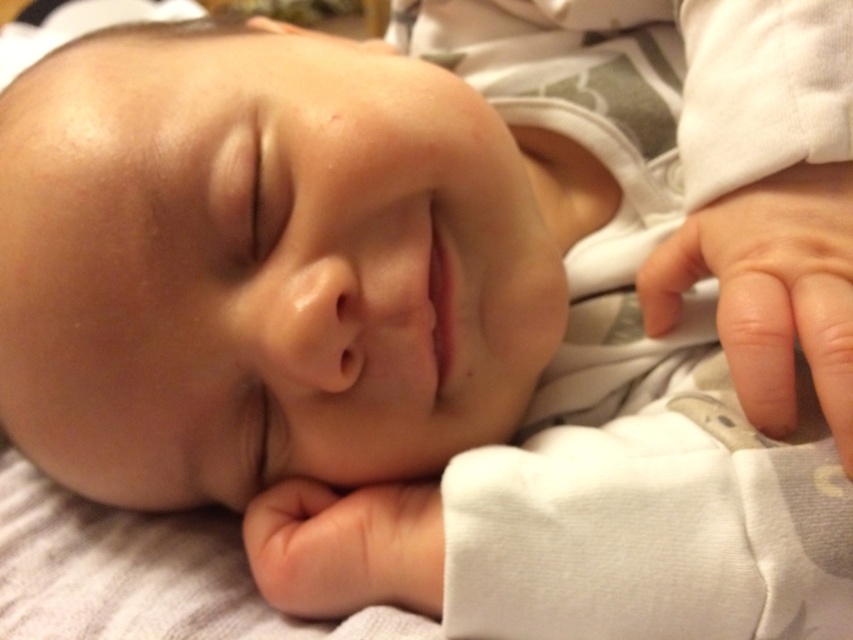
You are a photographer adjusting your camera settings to focus on the baby in the image. You notice two points of interest marked as point (782, 387) and point (419, 563). Which point should you focus on to ensure it appears sharper in the photo?

Point (782, 387) is closer to the camera than point (419, 563), so focusing on point (782, 387) will make it appear sharper in the photo.

In the image of the sleeping baby, there are two hands visible. The smooth skin hand at lower right and the smooth skin hand at lower center. Which one is positioned to the right side?

The smooth skin hand at lower right is positioned to the right of the smooth skin hand at lower center.

You are a photographer taking a close up of a baby. You want to ensure the baby stays in focus while the background is blurred. The baby has a hand in the frame. Where should you focus your camera to keep the smooth skin hand at lower right sharp?

You should focus your camera on the smooth skin hand at lower right located at point (770, 291) to keep it sharp while the background remains blurred.